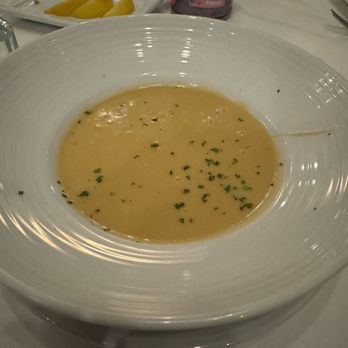
At what (x,y) coordinates should I click in order to perform the action: click on ceramic. Please return your answer as a coordinate pair (x, y). This screenshot has width=348, height=348. Looking at the image, I should click on (252, 51).